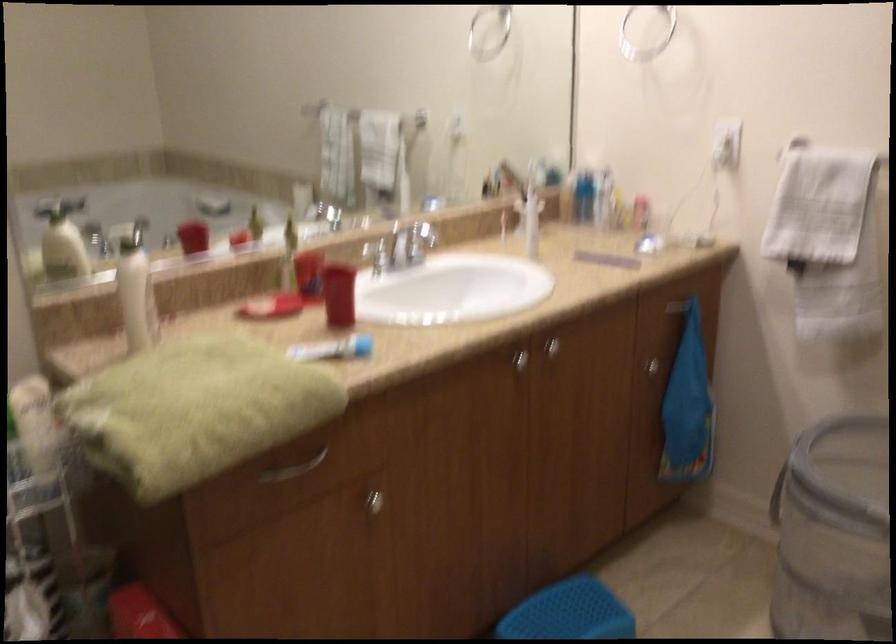
Find where to press the soap dispenser pump. Please return your answer as a coordinate pair (x, y).

(135, 290)